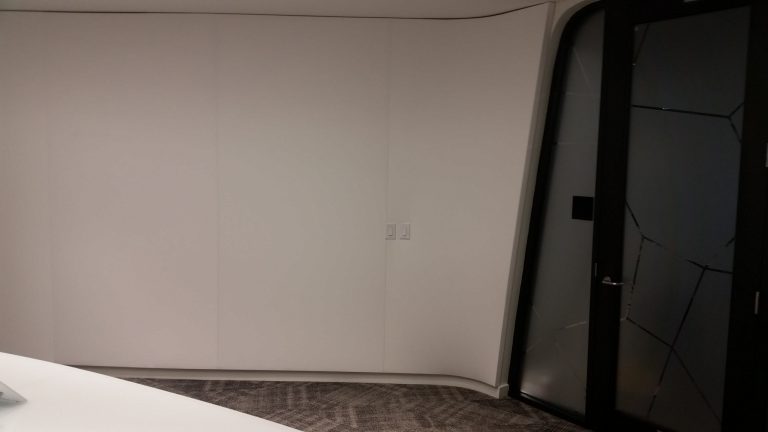
You are a GUI agent. You are given a task and a screenshot of the screen. Output one action in this format:
    pyautogui.click(x=<x>, y=<y>)
    Task: Click on the carpet
    
    Given the screenshot: What is the action you would take?
    pyautogui.click(x=434, y=416), pyautogui.click(x=356, y=414)